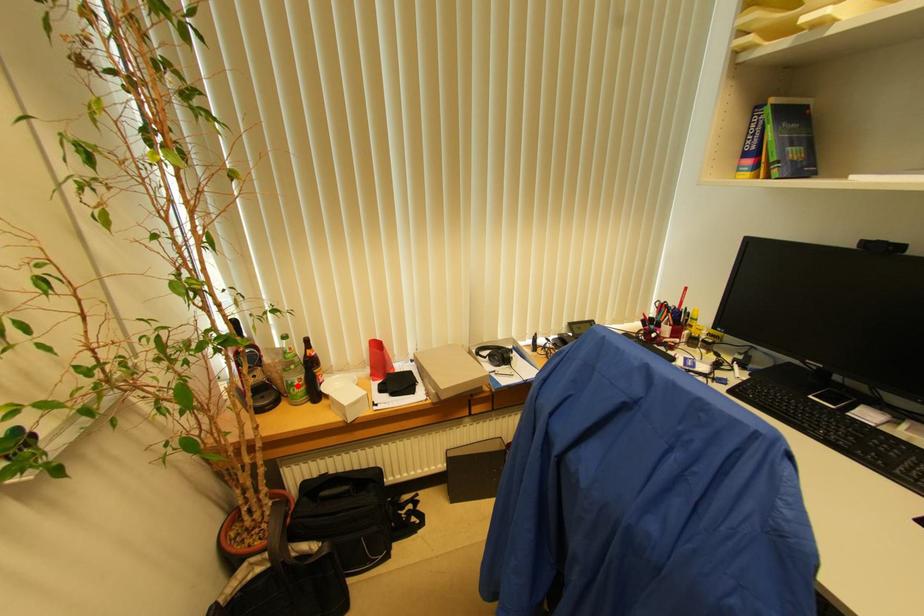
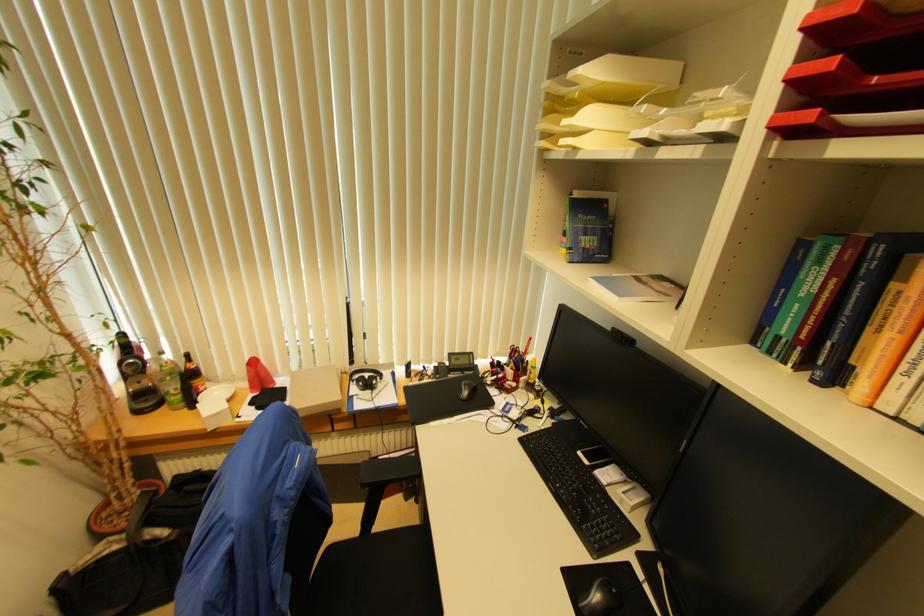
The point at the highlighted location is marked in the first image. Where is the corresponding point in the second image?

(174, 394)